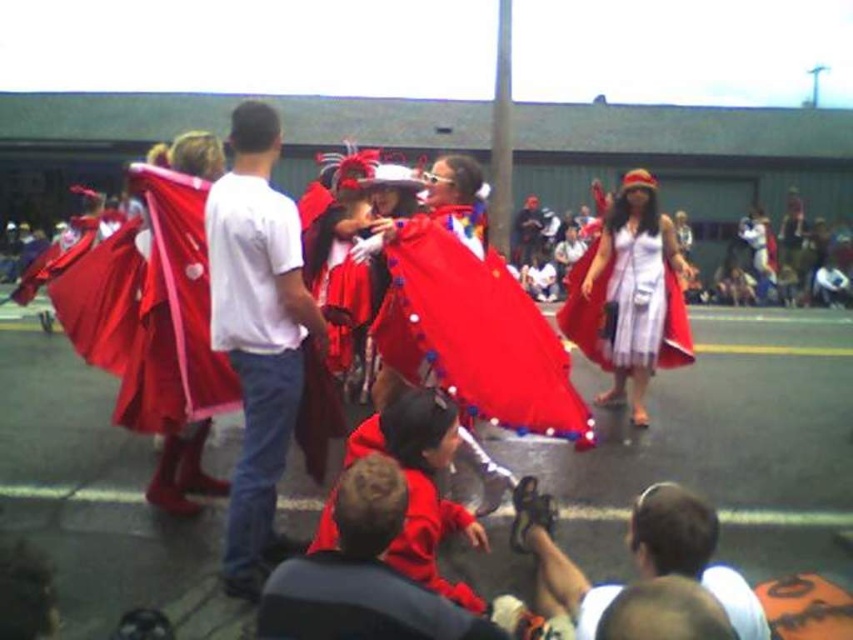
Question: Estimate the real-world distances between objects in this image. Which object is farther from the white cotton shirt at center?

Choices:
 (A) matte black sandals at lower center
 (B) white satin dress at center
 (C) shiny red cape at center

Answer: (B)

Question: Does white cotton shirt at center lie in front of matte black sandals at lower center?

Choices:
 (A) yes
 (B) no

Answer: (B)

Question: Is red velvet cape at center smaller than white satin dress at center?

Choices:
 (A) yes
 (B) no

Answer: (A)

Question: Which point is farther from the camera taking this photo?

Choices:
 (A) pyautogui.click(x=624, y=234)
 (B) pyautogui.click(x=527, y=259)
 (C) pyautogui.click(x=705, y=502)
 (D) pyautogui.click(x=386, y=301)

Answer: (B)

Question: Which point is farther to the camera?

Choices:
 (A) (577, 289)
 (B) (445, 310)
 (C) (294, 272)

Answer: (A)

Question: Is white cotton shirt at center further to camera compared to red velvet cape at center?

Choices:
 (A) yes
 (B) no

Answer: (A)